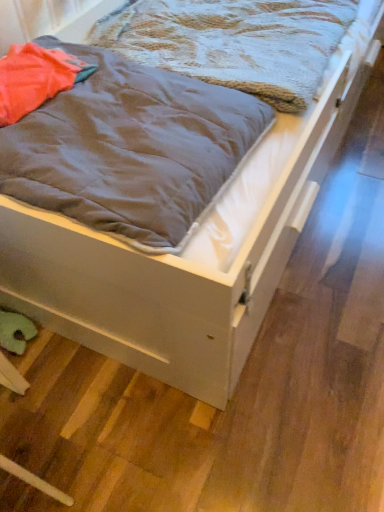
Question: Looking at their shapes, would you say gray matte blanket at center, the second blanket when ordered from back to front, is wider or thinner than textured gray blanket at upper left, the 1th blanket positioned from the back?

Choices:
 (A) wide
 (B) thin

Answer: (B)

Question: Relative to textured gray blanket at upper left, the 1th blanket positioned from the back, is gray matte blanket at center, the second blanket when ordered from back to front, in front or behind?

Choices:
 (A) behind
 (B) front

Answer: (B)

Question: Is gray matte blanket at center, positioned as the first blanket in front-to-back order, taller or shorter than textured gray blanket at upper left, the 1th blanket positioned from the back?

Choices:
 (A) tall
 (B) short

Answer: (A)

Question: In the image, is textured gray blanket at upper left, the 2th blanket from the front, positioned in front of or behind gray matte blanket at center, positioned as the first blanket in front-to-back order?

Choices:
 (A) behind
 (B) front

Answer: (A)

Question: Is textured gray blanket at upper left, the 1th blanket positioned from the back, situated inside gray matte blanket at center, the second blanket when ordered from back to front, or outside?

Choices:
 (A) outside
 (B) inside

Answer: (A)

Question: Does point (306, 44) appear closer or farther from the camera than point (120, 103)?

Choices:
 (A) farther
 (B) closer

Answer: (A)

Question: Considering the positions of textured gray blanket at upper left, the 2th blanket from the front, and gray matte blanket at center, positioned as the first blanket in front-to-back order, in the image, is textured gray blanket at upper left, the 2th blanket from the front, wider or thinner than gray matte blanket at center, positioned as the first blanket in front-to-back order,?

Choices:
 (A) wide
 (B) thin

Answer: (A)